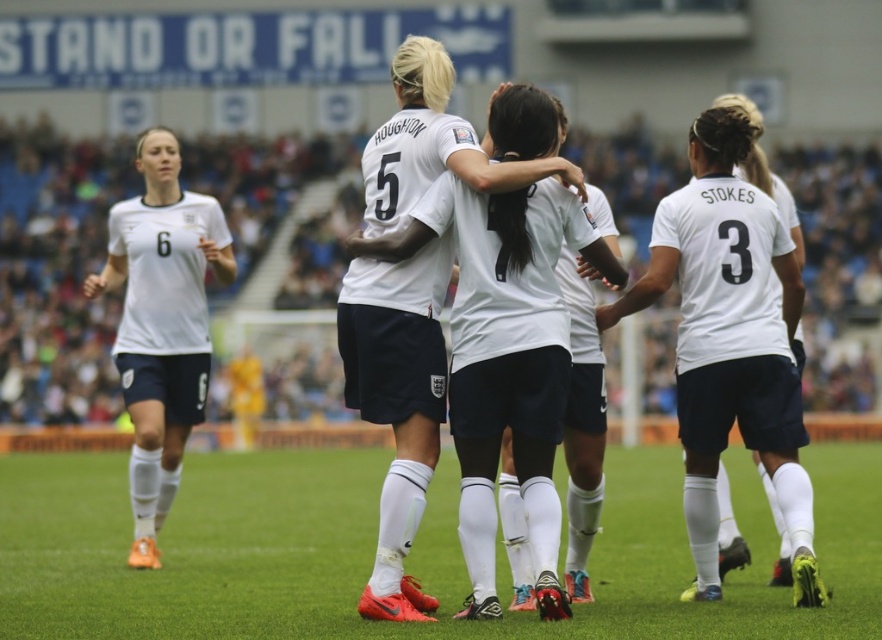
In the scene shown: You are a soccer coach observing the field. You notice the white synthetic turf at center and the white matte jersey at left. Which object is shorter in height?

The white synthetic turf at center is shorter in height than the white matte jersey at left.

You are a soccer player wearing the white matte jersey at left and you want to pass the ball to your teammate standing on the white synthetic turf at center. Can you directly pass the ball without it being blocked by any players in between?

The white synthetic turf at center is in front of the white matte jersey at left, so there are no players blocking the path between the white matte jersey at left and the white synthetic turf at center. You can pass the ball directly.